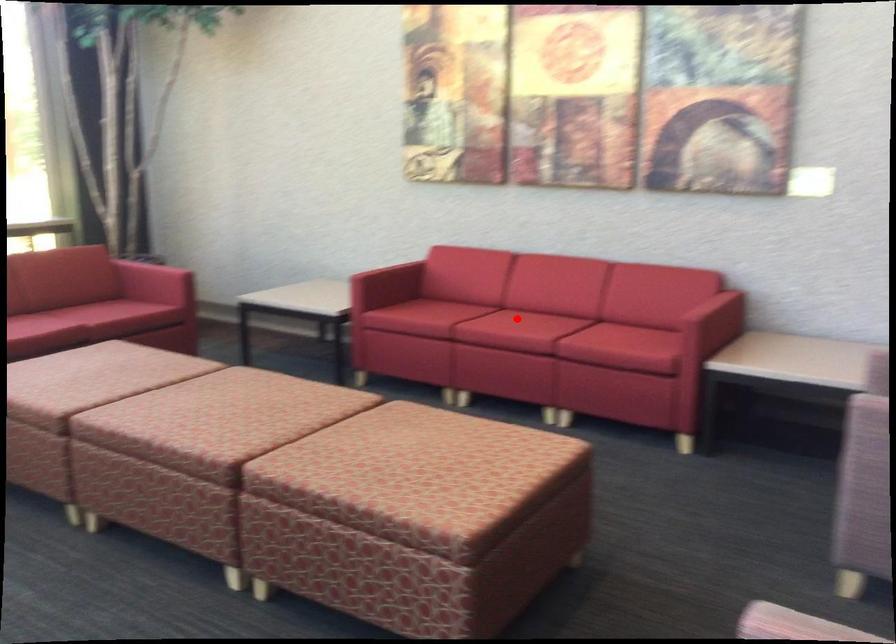
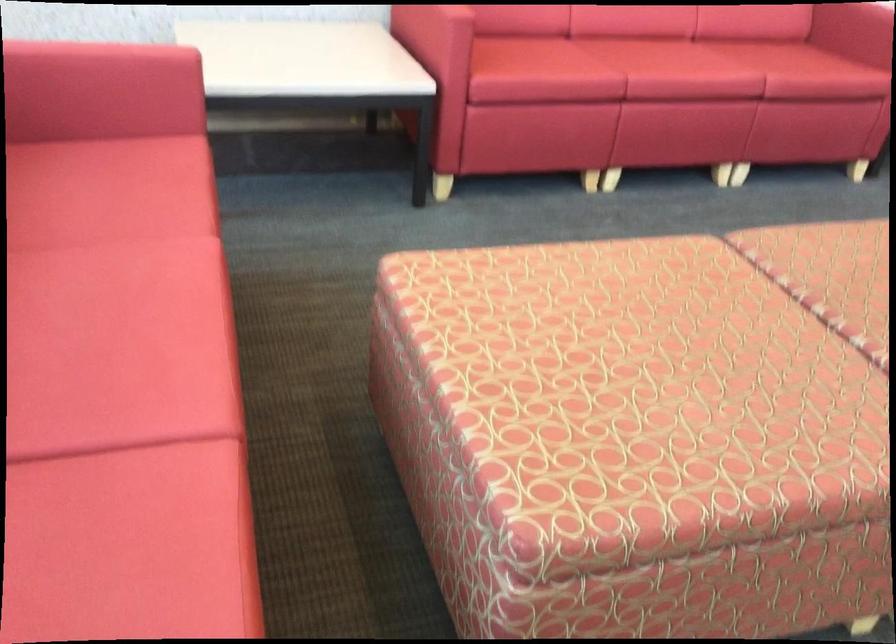
Question: I am providing you with two images of the same scene from different viewpoints. A red point is shown in image1. For the corresponding object point in image2, is it positioned nearer or farther from the camera?

Choices:
 (A) Nearer
 (B) Farther

Answer: (A)